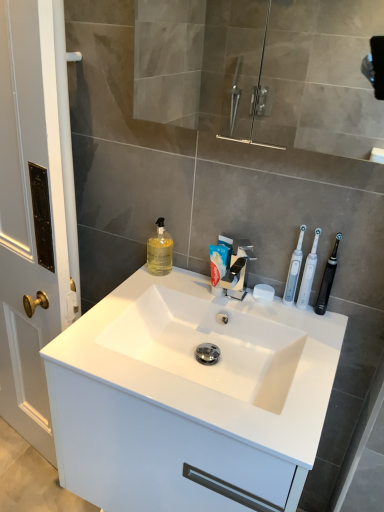
Find the location of `free space in front of white plastic toothbrushes at right, which is the third toothbrush in right-to-left order`. free space in front of white plastic toothbrushes at right, which is the third toothbrush in right-to-left order is located at coordinates (304, 335).